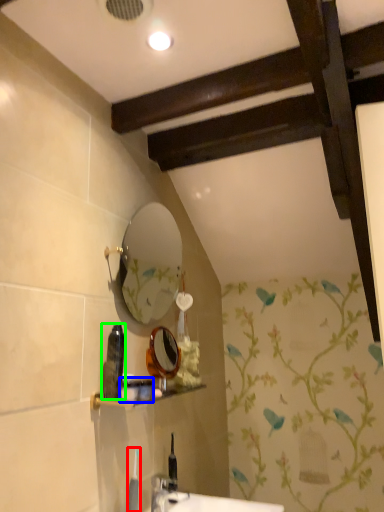
Question: Based on their relative distances, which object is nearer to toiletry (highlighted by a red box)? Choose from toiletry (highlighted by a blue box) and toiletry (highlighted by a green box).

Choices:
 (A) toiletry
 (B) toiletry

Answer: (A)